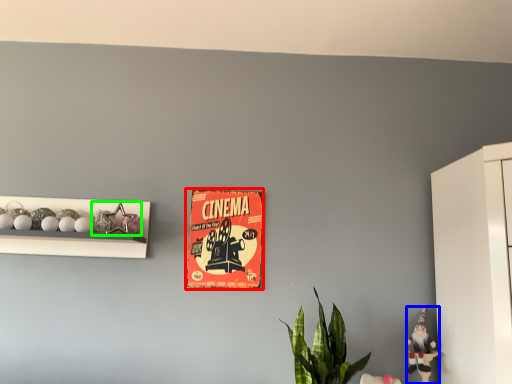
Question: Which object is positioned closest to postcard (highlighted by a red box)? Select from toy (highlighted by a blue box) and toy (highlighted by a green box).

Choices:
 (A) toy
 (B) toy

Answer: (B)